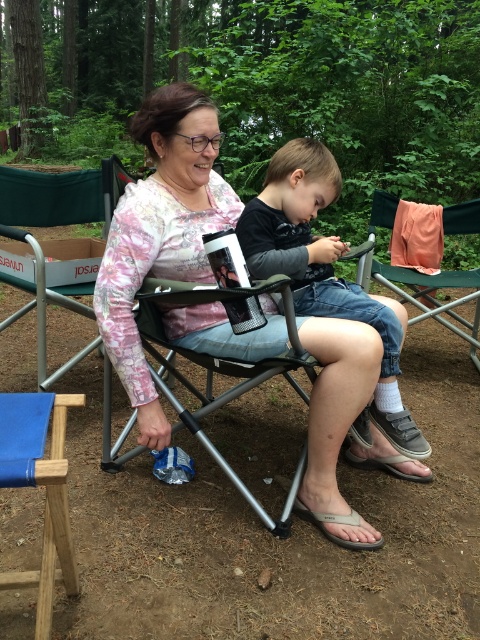
You are standing at the campsite and want to find the point marked at coordinates (160, 232). Based on the scene description, where would this point be located?

The point marked at coordinates (160, 232) is located on the pink floral shirt at center.

You are standing in the campsite and see the metallic silver chair at center and the green fabric chair at center. Which chair is positioned to the left?

The metallic silver chair at center is positioned to the left of the green fabric chair at center.

You are standing in the campsite and want to hand a snack to the person wearing the pink floral shirt at center and the dark gray fabric toddler at center. Which one will you need to reach further to give the snack to?

The dark gray fabric toddler at center is further away from you than the pink floral shirt at center, so you will need to reach further to give the snack to the dark gray fabric toddler at center.